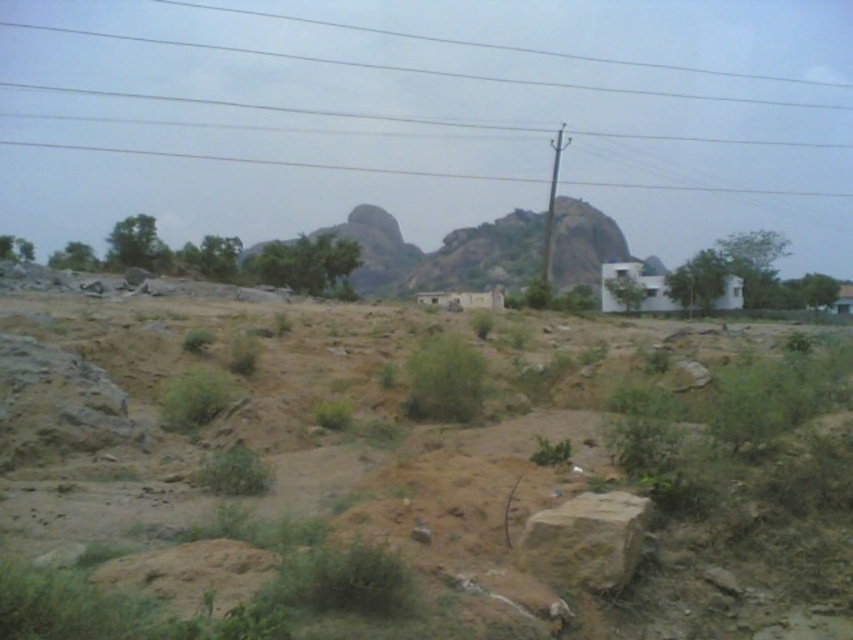
Question: Considering the relative positions of brown rough rock at center and green grass at center in the image provided, where is brown rough rock at center located with respect to green grass at center?

Choices:
 (A) below
 (B) above

Answer: (A)

Question: Which object is closer to the camera taking this photo?

Choices:
 (A) smooth wire at upper center
 (B) brown sandy dirt field at center
 (C) green grass at center

Answer: (B)

Question: Which object appears closest to the camera in this image?

Choices:
 (A) green grass at center
 (B) brown rough rock at center

Answer: (B)

Question: Does brown sandy dirt field at center have a larger size compared to green grass at center?

Choices:
 (A) yes
 (B) no

Answer: (A)

Question: Is smooth wire at upper center smaller than brown rough rock at center?

Choices:
 (A) yes
 (B) no

Answer: (B)

Question: Which of the following is the farthest from the observer?

Choices:
 (A) brown rough rock at center
 (B) green grass at center
 (C) smooth wire at upper center
 (D) brown sandy dirt field at center

Answer: (C)